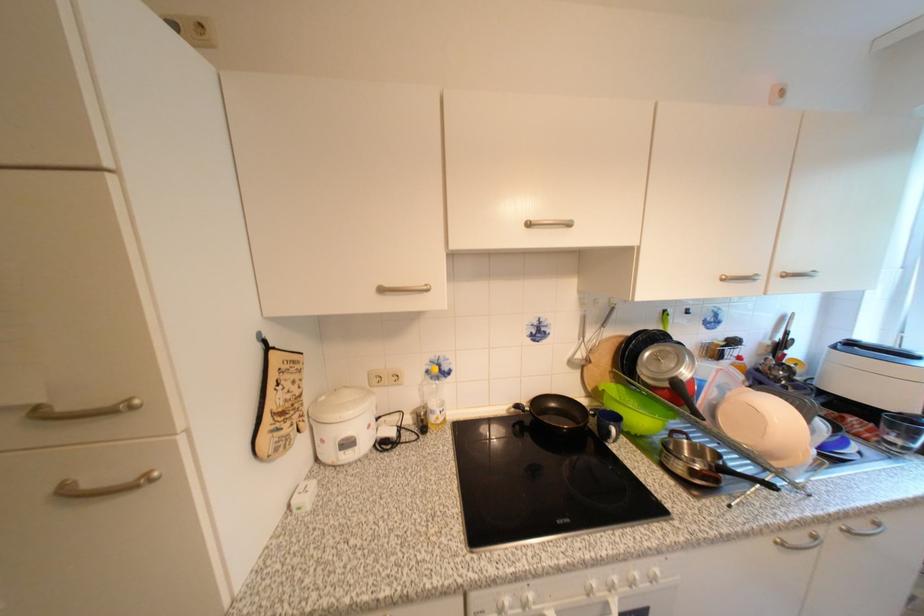
Image resolution: width=924 pixels, height=616 pixels. What do you see at coordinates (517, 402) in the screenshot? I see `the black pan handle` at bounding box center [517, 402].